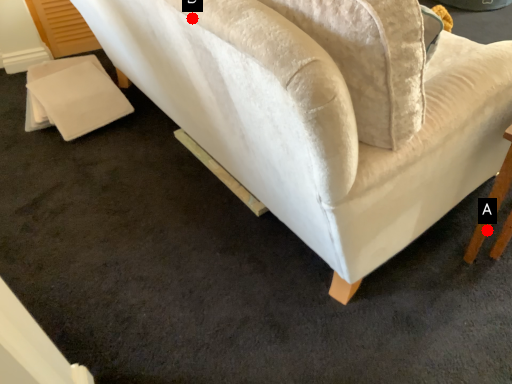
Question: Two points are circled on the image, labeled by A and B beside each circle. Which of the following is the farthest from the observer?

Choices:
 (A) A is further
 (B) B is further

Answer: (A)